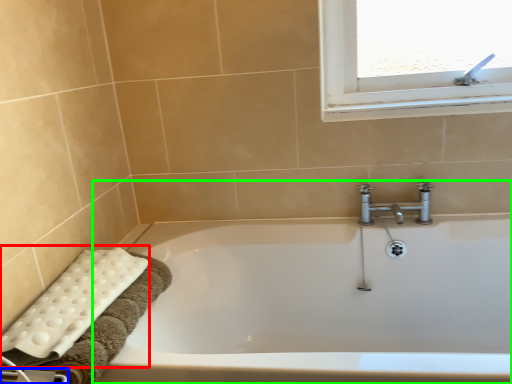
Question: Which object is positioned closest to bath towel (highlighted by a red box)? Select from towel bar (highlighted by a blue box) and bathtub (highlighted by a green box).

Choices:
 (A) towel bar
 (B) bathtub

Answer: (A)